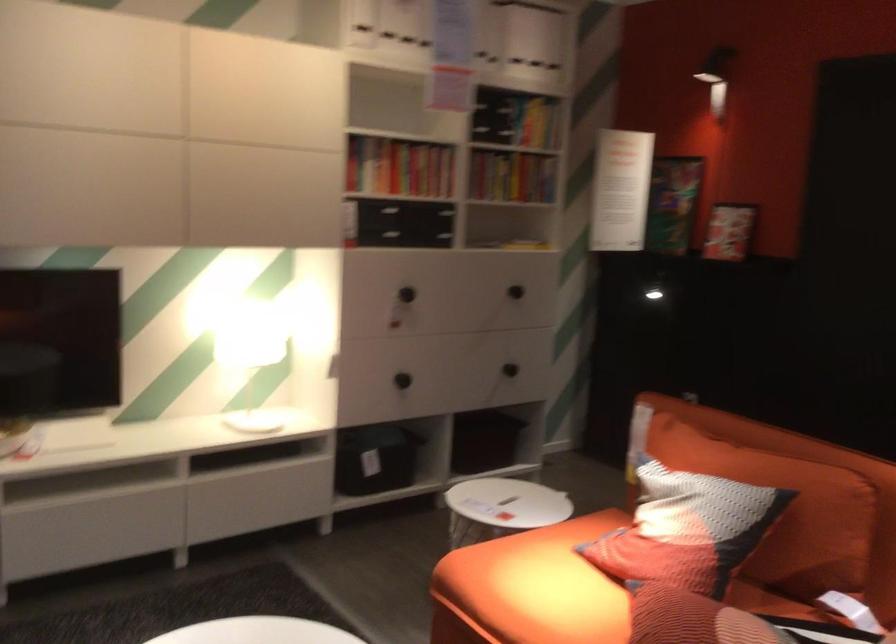
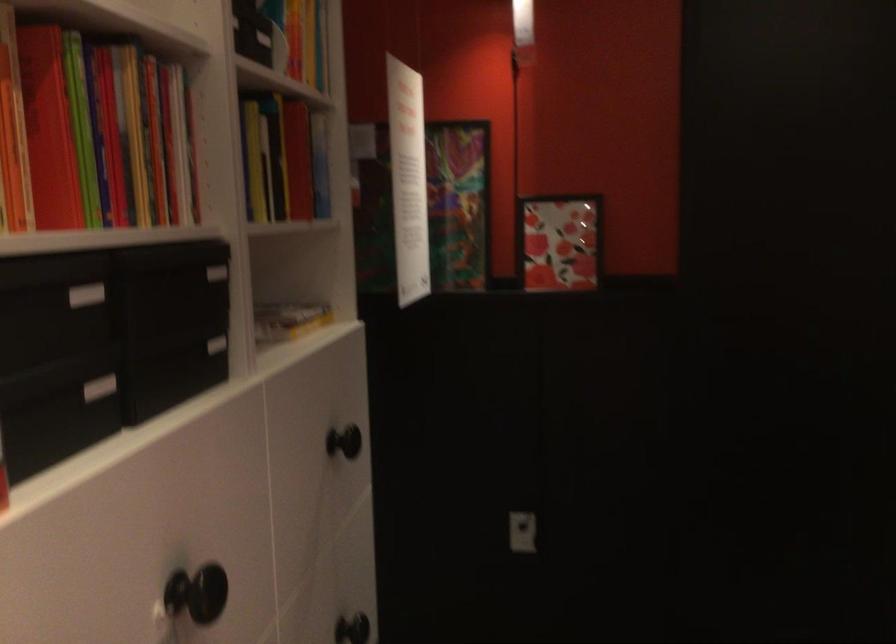
In the second image, find the point that corresponds to pixel 522 355 in the first image.

(351, 629)